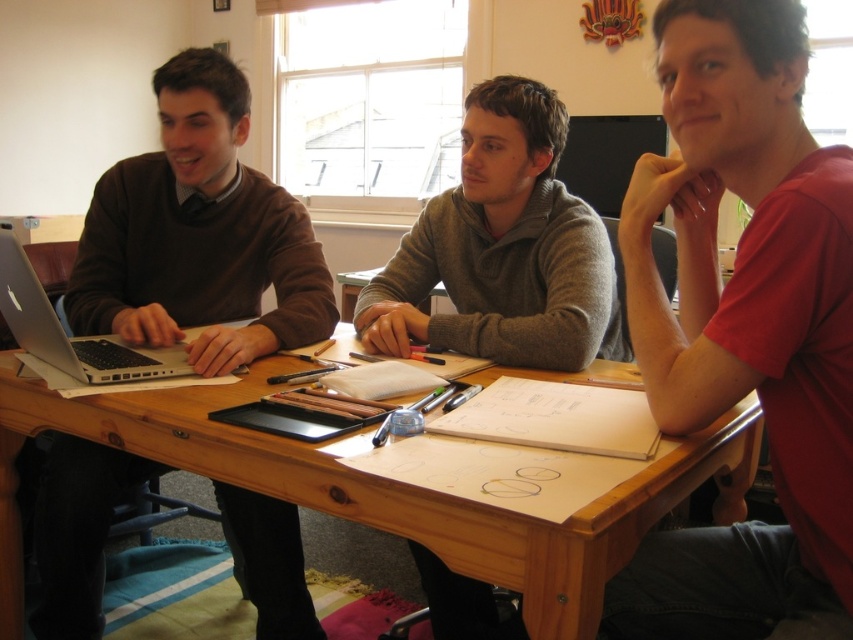
Which of these two, red matte shirt at center or wooden table at center, stands shorter?

With less height is wooden table at center.

Is red matte shirt at center smaller than wooden table at center?

Indeed, red matte shirt at center has a smaller size compared to wooden table at center.

Which is behind, point (672, 394) or point (10, 458)?

Positioned behind is point (10, 458).

Where is `red matte shirt at center`? The image size is (853, 640). red matte shirt at center is located at coordinates (744, 328).

Is wooden table at center smaller than silver metallic laptop at left?

No, wooden table at center is not smaller than silver metallic laptop at left.

Who is higher up, wooden table at center or silver metallic laptop at left?

Positioned higher is silver metallic laptop at left.

Who is more distant from viewer, (570, 612) or (49, 362)?

The point (49, 362) is more distant.

Identify the location of wooden table at center. (380, 490).

Can you confirm if matte brown sweater at left is bigger than wooden table at center?

No, matte brown sweater at left is not bigger than wooden table at center.

Between point (276, 627) and point (677, 452), which one is positioned in front?

Point (677, 452)

Find the location of a particular element. The height and width of the screenshot is (640, 853). matte brown sweater at left is located at coordinates (199, 234).